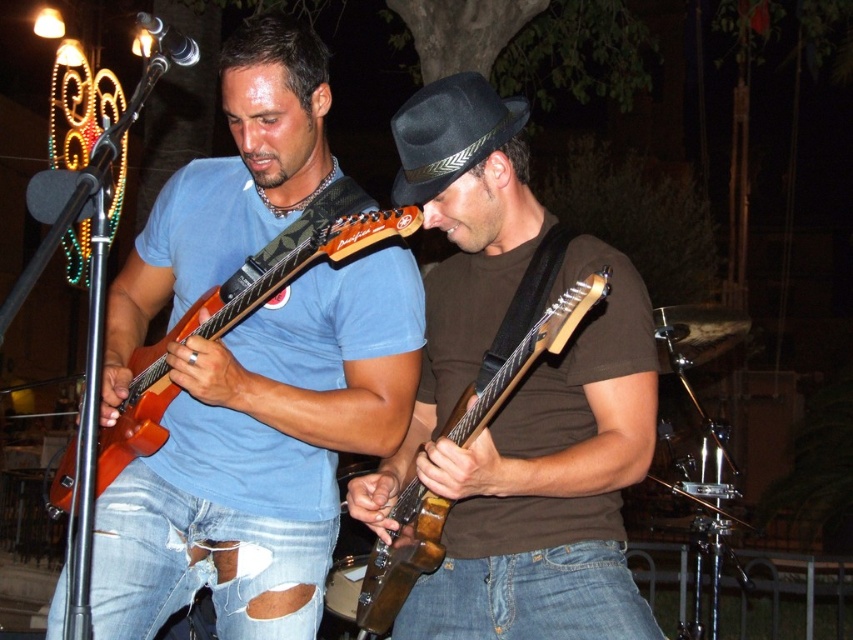
Based on the scene description, can you determine the spatial relationship between the orange matte electric guitar at center and the denim jeans at lower center?

The orange matte electric guitar at center is located above the denim jeans at lower center.

You are a photographer at the event and want to capture a photo where both the denim jeans at lower center and the wooden electric guitar at center are visible. Based on their positions, which object should you ensure is placed closer to the left side of the frame to include both in the shot?

Since the denim jeans at lower center are to the right of the wooden electric guitar at center, you should position the wooden electric guitar at center closer to the left side of the frame to ensure both objects are included in the photo.

You are a photographer at the event and want to capture a clear shot of both the wooden electric guitar at center and the black felt fedora at center. Since both are at center, will the guitar block the view of the hat in your photo?

The wooden electric guitar at center is in front of the black felt fedora at center, so the guitar will block the view of the hat in the photo.